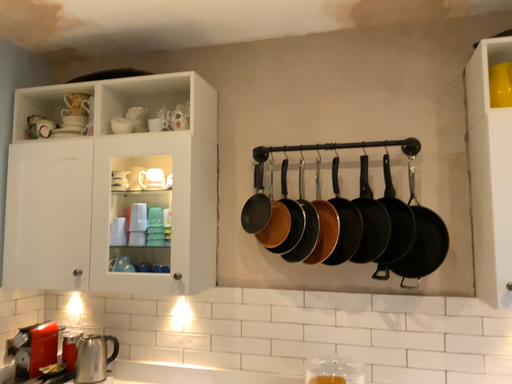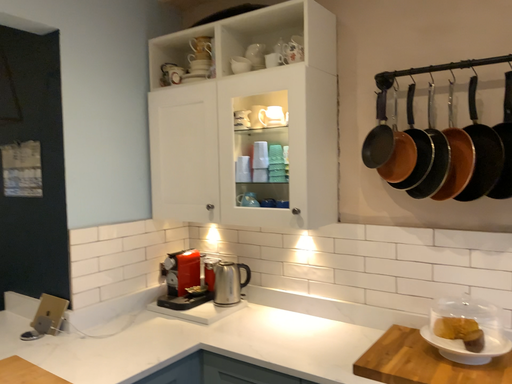
Question: Which way did the camera rotate in the video?

Choices:
 (A) rotated downward
 (B) rotated upward

Answer: (A)